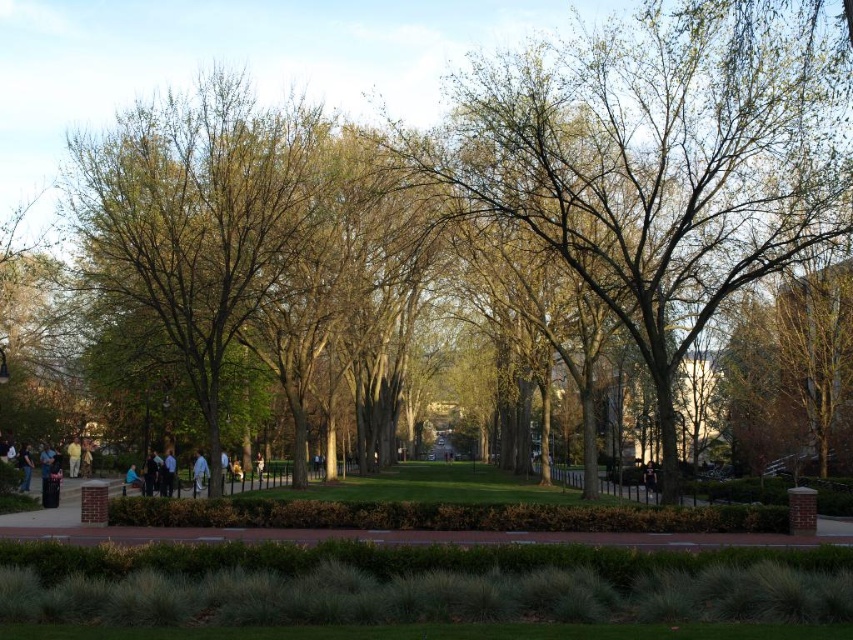
Does brown brick path at center have a greater height compared to light blue fabric at center?

Correct, brown brick path at center is much taller as light blue fabric at center.

Does brown brick path at center appear on the right side of light blue fabric at center?

Yes, brown brick path at center is to the right of light blue fabric at center.

Does point (341, 536) come behind point (202, 481)?

That is False.

Where is `brown brick path at center`? brown brick path at center is located at coordinates (410, 536).